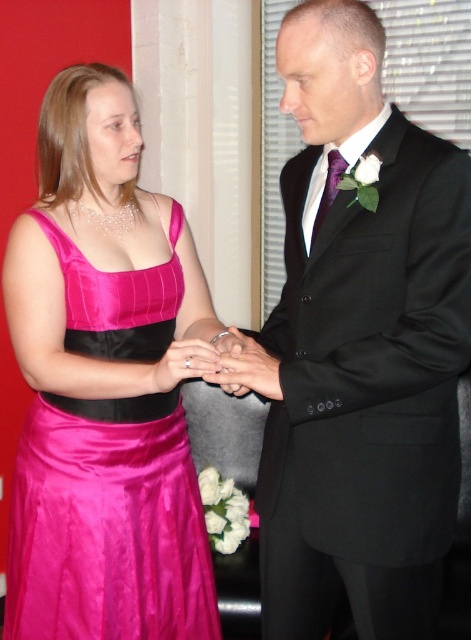
Who is more distant from viewer, (x=248, y=340) or (x=185, y=364)?

Point (x=248, y=340)

Does point (259, 362) lie behind point (186, 362)?

No, (259, 362) is closer to viewer.

What are the coordinates of `matte black ring at center` in the screenshot? It's located at (248, 369).

Can you confirm if black satin suit at center is positioned below satin pink dress at center?

Actually, black satin suit at center is above satin pink dress at center.

Describe the element at coordinates (362, 348) in the screenshot. The image size is (471, 640). I see `black satin suit at center` at that location.

Which is behind, point (289, 193) or point (162, 380)?

Positioned behind is point (289, 193).

The image size is (471, 640). What are the coordinates of `black satin suit at center` in the screenshot? It's located at (362, 348).

Between shiny pink dress at left and satin pink dress at center, which one appears on the left side from the viewer's perspective?

From the viewer's perspective, shiny pink dress at left appears more on the left side.

Between point (172, 600) and point (214, 358), which one is positioned behind?

The point (172, 600) is more distant.

At what (x,y) coordinates should I click in order to perform the action: click on shiny pink dress at left. Please return your answer as a coordinate pair (x, y). The height and width of the screenshot is (640, 471). Looking at the image, I should click on click(107, 524).